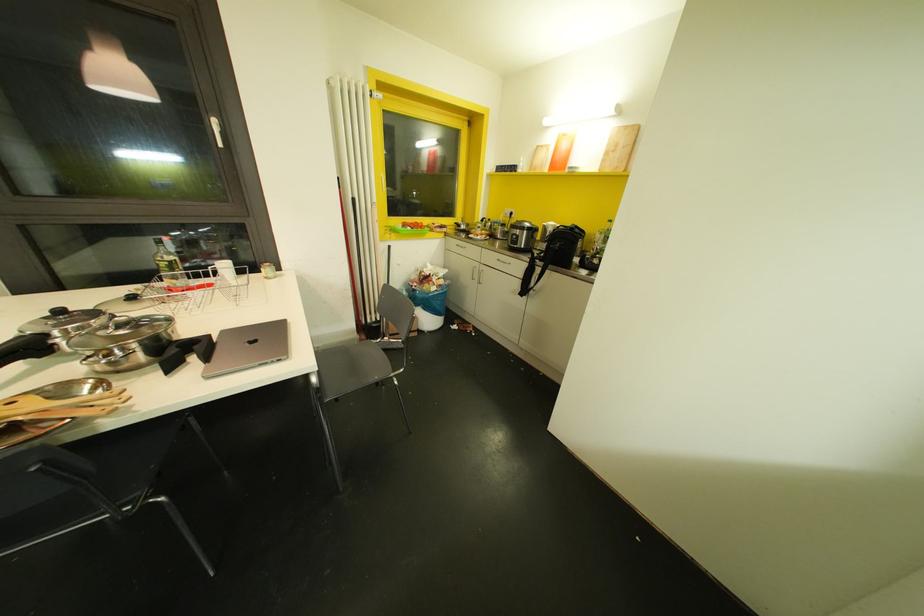
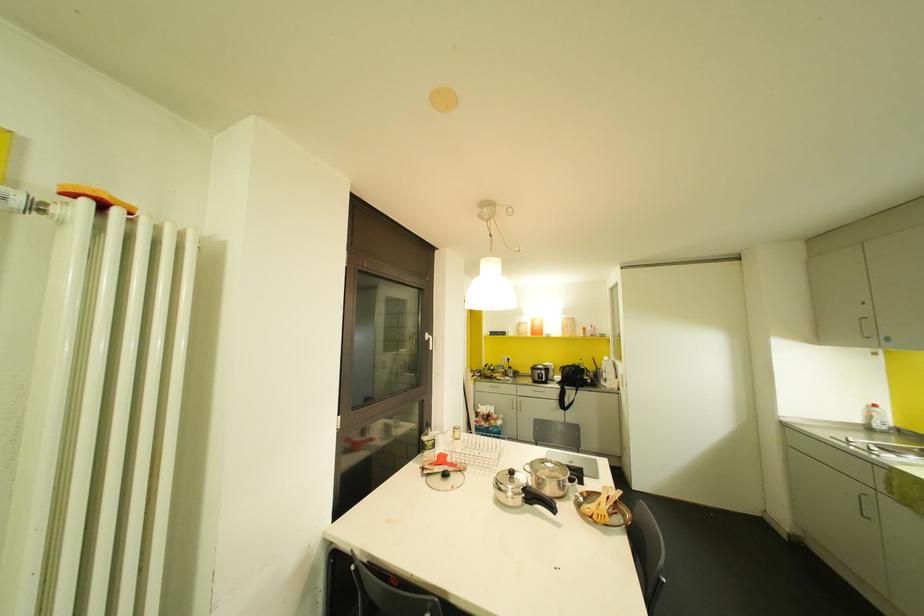
Locate, in the second image, the point that corresponds to point (220, 145) in the first image.

(430, 347)